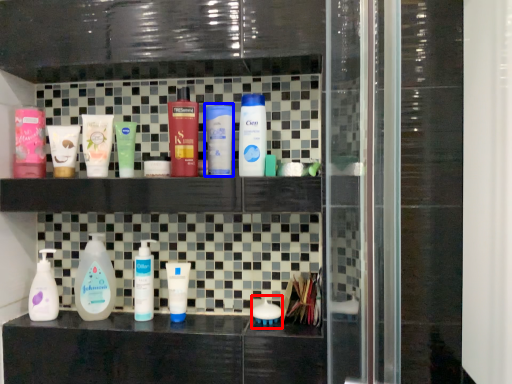
Question: Among these objects, which one is nearest to the camera, toiletry (highlighted by a red box) or toiletry (highlighted by a blue box)?

Choices:
 (A) toiletry
 (B) toiletry

Answer: (B)